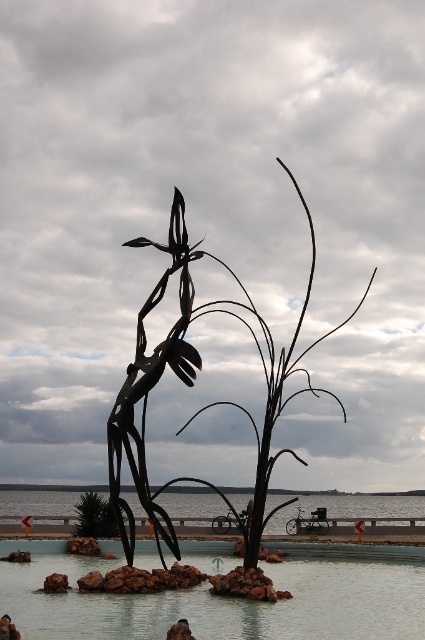
Question: In this image, where is smooth concrete pool at center located relative to clear water at center?

Choices:
 (A) left
 (B) right

Answer: (B)

Question: Which point appears farthest from the camera in this image?

Choices:
 (A) (212, 257)
 (B) (334, 497)
 (C) (410, 625)

Answer: (B)

Question: Can you confirm if clear water at center is thinner than brown rock at lower left?

Choices:
 (A) no
 (B) yes

Answer: (A)

Question: Among these objects, which one is nearest to the camera?

Choices:
 (A) brown rock at lower left
 (B) green leafy tree at center
 (C) clear water at center

Answer: (A)

Question: From the image, what is the correct spatial relationship of black metal tree at center in relation to green leafy tree at center?

Choices:
 (A) left
 (B) right

Answer: (B)

Question: Which object appears farthest from the camera in this image?

Choices:
 (A) black metal tree at center
 (B) smooth concrete pool at center
 (C) clear water at center

Answer: (C)